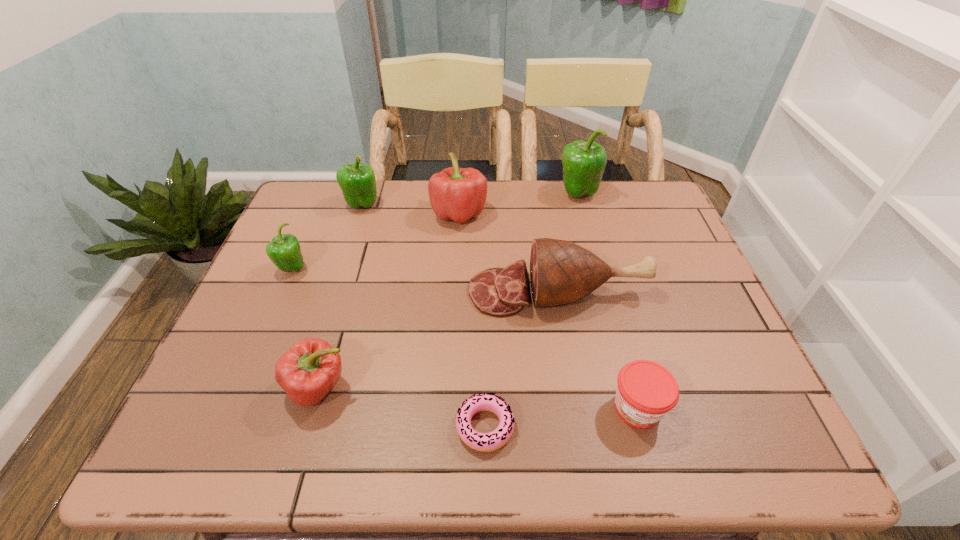
Where is `vacant area that lies between the ham and the farther pink bell pepper`? This screenshot has height=540, width=960. vacant area that lies between the ham and the farther pink bell pepper is located at coordinates (509, 253).

Where is `empty space between the ham and the leftmost green bell pepper`? Image resolution: width=960 pixels, height=540 pixels. empty space between the ham and the leftmost green bell pepper is located at coordinates (425, 280).

At what (x,y) coordinates should I click in order to perform the action: click on object that stands as the fourth closest to the second green bell pepper from right to left. Please return your answer as a coordinate pair (x, y). Looking at the image, I should click on (308, 371).

Select which object is the sixth closest to the fourth farthest bell pepper. Please provide its 2D coordinates. Your answer should be formatted as a tuple, i.e. [(x, y)], where the tuple contains the x and y coordinates of a point satisfying the conditions above.

[(584, 163)]

Identify the location of bell pepper object that ranks as the second closest to the second green bell pepper from left to right. 284,250.

Identify the location of the fourth closest bell pepper relative to the biggest green bell pepper. (308, 371).

Where is `green bell pepper that is the third closest one to the pink doughnut`? The width and height of the screenshot is (960, 540). green bell pepper that is the third closest one to the pink doughnut is located at coordinates (584, 163).

Select which green bell pepper appears as the closest to the doughnut. Please provide its 2D coordinates. Your answer should be formatted as a tuple, i.e. [(x, y)], where the tuple contains the x and y coordinates of a point satisfying the conditions above.

[(284, 250)]

The height and width of the screenshot is (540, 960). Find the location of `vacant space that satisfies the following two spatial constraints: 1. on the front side of the second smallest green bell pepper; 2. on the left side of the farther pink bell pepper`. vacant space that satisfies the following two spatial constraints: 1. on the front side of the second smallest green bell pepper; 2. on the left side of the farther pink bell pepper is located at coordinates (359, 214).

Locate an element on the screen. vacant space that satisfies the following two spatial constraints: 1. on the front side of the nearer pink bell pepper; 2. on the left side of the pink doughnut is located at coordinates tap(308, 427).